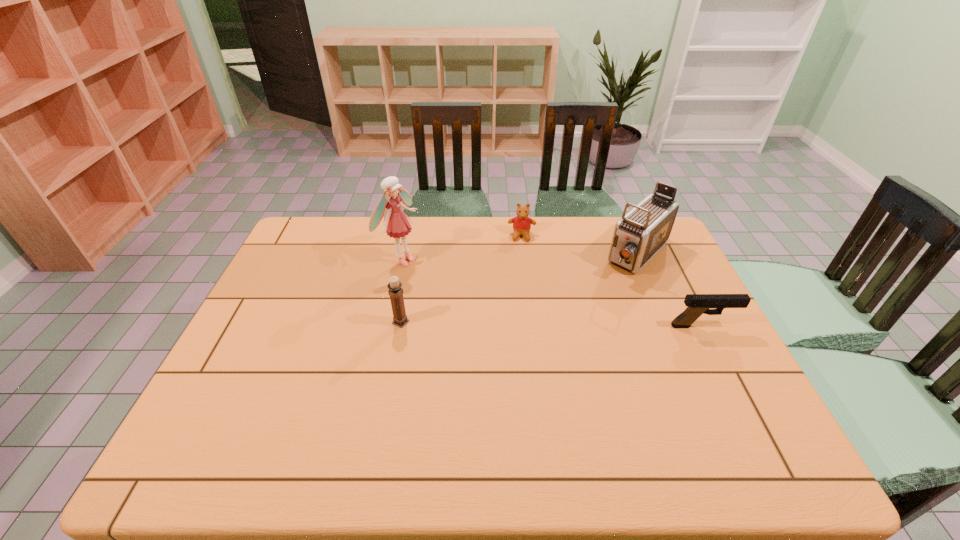
The width and height of the screenshot is (960, 540). What are the coordinates of `the third tallest object` in the screenshot? It's located at (395, 291).

Find the location of a particular element. Image resolution: width=960 pixels, height=540 pixels. pistol is located at coordinates (698, 304).

Locate an element on the screen. The width and height of the screenshot is (960, 540). the second tallest object is located at coordinates (640, 233).

This screenshot has height=540, width=960. Identify the location of teddy bear. (522, 223).

Identify the location of the tallest object. Image resolution: width=960 pixels, height=540 pixels. (398, 225).

You are a GUI agent. You are given a task and a screenshot of the screen. Output one action in this format:
    pyautogui.click(x=<x>, y=<y>)
    Task: Click on the free location located 0.050m on the front of the third tallest object
    The width and height of the screenshot is (960, 540).
    Given the screenshot: What is the action you would take?
    pyautogui.click(x=397, y=342)

Find the location of a particular element. vacant area situated 0.130m at the lens of the fourth shortest object is located at coordinates [602, 297].

Find the location of a particular element. vacant space located at the lens of the fourth shortest object is located at coordinates (586, 313).

The width and height of the screenshot is (960, 540). I want to click on vacant area situated at the lens of the fourth shortest object, so click(588, 311).

Find the location of a particular element. The width and height of the screenshot is (960, 540). free region located 0.310m on the front-facing side of the teddy bear is located at coordinates (519, 306).